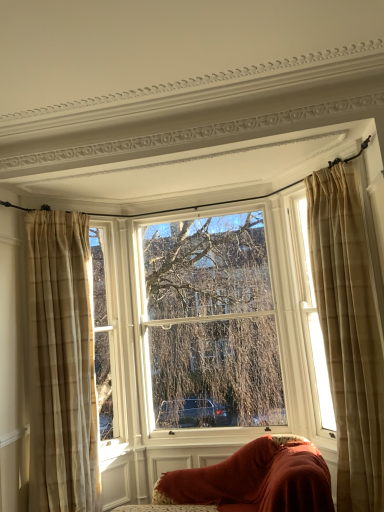
Question: Based on their positions, is beige plaid curtain at right, which is counted as the first curtain, starting from the right, located to the left or right of sheer beige curtains at right, which is the 2th window from left to right?

Choices:
 (A) left
 (B) right

Answer: (B)

Question: In terms of height, does beige plaid curtain at right, which is counted as the first curtain, starting from the right, look taller or shorter compared to sheer beige curtains at right, which appears as the 1th window when viewed from the right?

Choices:
 (A) short
 (B) tall

Answer: (B)

Question: Which object is positioned closest to the sheer beige curtains at right, which is the 2th window from left to right?

Choices:
 (A) beige plaid curtain at right, which ranks as the second curtain in left-to-right order
 (B) velvet red sofa at lower center
 (C) clear glass window at center, marked as the 1th window in a left-to-right arrangement
 (D) beige plaid curtain at left, which ranks as the second curtain in right-to-left order

Answer: (A)

Question: Which of these objects is positioned closest to the sheer beige curtains at right, which is the 2th window from left to right?

Choices:
 (A) clear glass window at center, placed as the 2th window when sorted from right to left
 (B) velvet red sofa at lower center
 (C) beige plaid curtain at left, arranged as the 1th curtain when viewed from the left
 (D) beige plaid curtain at right, which is counted as the first curtain, starting from the right

Answer: (D)